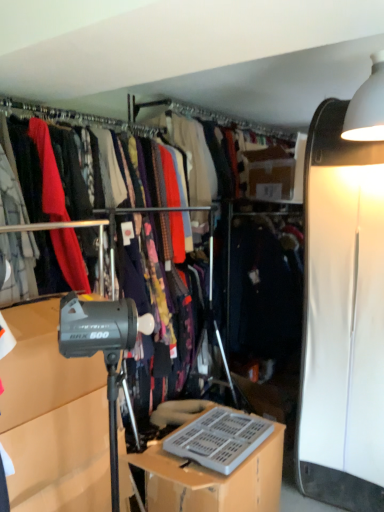
Question: Does gray plastic keyboard at lower center have a greater height compared to gray matte tripod at lower left?

Choices:
 (A) no
 (B) yes

Answer: (A)

Question: Could you tell me if gray plastic keyboard at lower center is turned towards gray matte tripod at lower left?

Choices:
 (A) yes
 (B) no

Answer: (B)

Question: From a real-world perspective, is gray plastic keyboard at lower center under gray matte tripod at lower left?

Choices:
 (A) no
 (B) yes

Answer: (B)

Question: Is gray plastic keyboard at lower center at the left side of gray matte tripod at lower left?

Choices:
 (A) no
 (B) yes

Answer: (A)

Question: Can you confirm if gray plastic keyboard at lower center is smaller than gray matte tripod at lower left?

Choices:
 (A) yes
 (B) no

Answer: (B)

Question: Is gray plastic keyboard at lower center far from gray matte tripod at lower left?

Choices:
 (A) yes
 (B) no

Answer: (B)

Question: Is gray matte tripod at lower left looking in the opposite direction of gray plastic keyboard at lower center?

Choices:
 (A) yes
 (B) no

Answer: (B)

Question: Considering the relative positions of gray matte tripod at lower left and gray plastic keyboard at lower center in the image provided, is gray matte tripod at lower left to the left of gray plastic keyboard at lower center from the viewer's perspective?

Choices:
 (A) yes
 (B) no

Answer: (A)

Question: Can you see gray matte tripod at lower left touching gray plastic keyboard at lower center?

Choices:
 (A) no
 (B) yes

Answer: (A)

Question: Can you confirm if gray matte tripod at lower left is thinner than gray plastic keyboard at lower center?

Choices:
 (A) yes
 (B) no

Answer: (A)

Question: Is gray matte tripod at lower left taller than gray plastic keyboard at lower center?

Choices:
 (A) no
 (B) yes

Answer: (B)

Question: Is gray matte tripod at lower left closer to camera compared to gray plastic keyboard at lower center?

Choices:
 (A) no
 (B) yes

Answer: (B)

Question: Is gray plastic keyboard at lower center to the left or to the right of gray matte tripod at lower left in the image?

Choices:
 (A) right
 (B) left

Answer: (A)